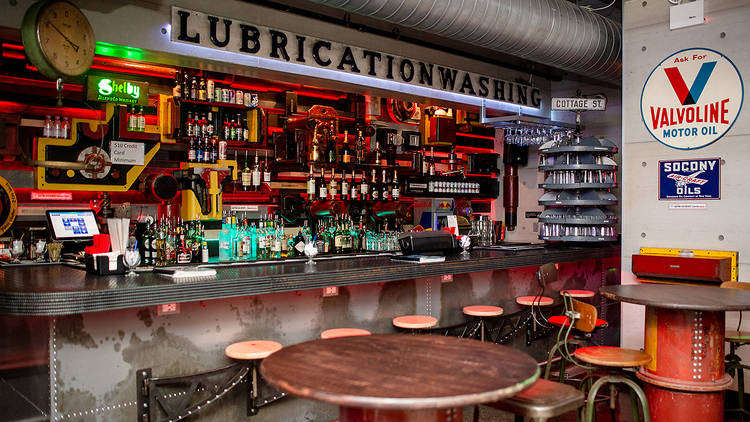
Where is `pink wood bar seat`? This screenshot has height=422, width=750. pink wood bar seat is located at coordinates (253, 344), (344, 325), (417, 319), (489, 303), (525, 301), (583, 291).